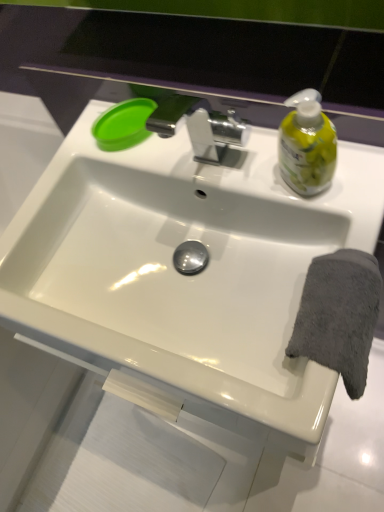
The width and height of the screenshot is (384, 512). I want to click on blank space to the left of green plastic lid at upper left, so pyautogui.click(x=69, y=162).